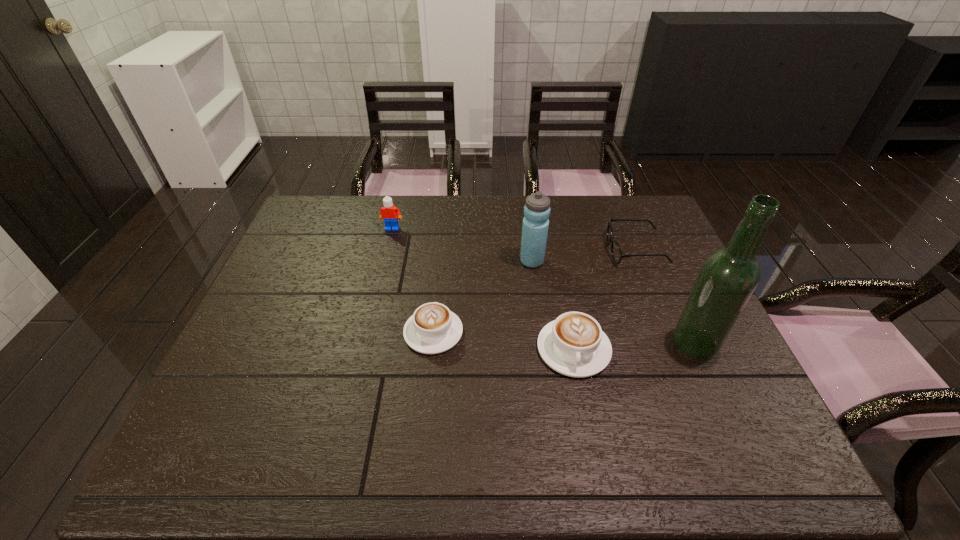
Please point a spot to add another cappuccino on the right. Please provide its 2D coordinates. Your answer should be formatted as a tuple, i.e. [(x, y)], where the tuple contains the x and y coordinates of a point satisfying the conditions above.

[(725, 366)]